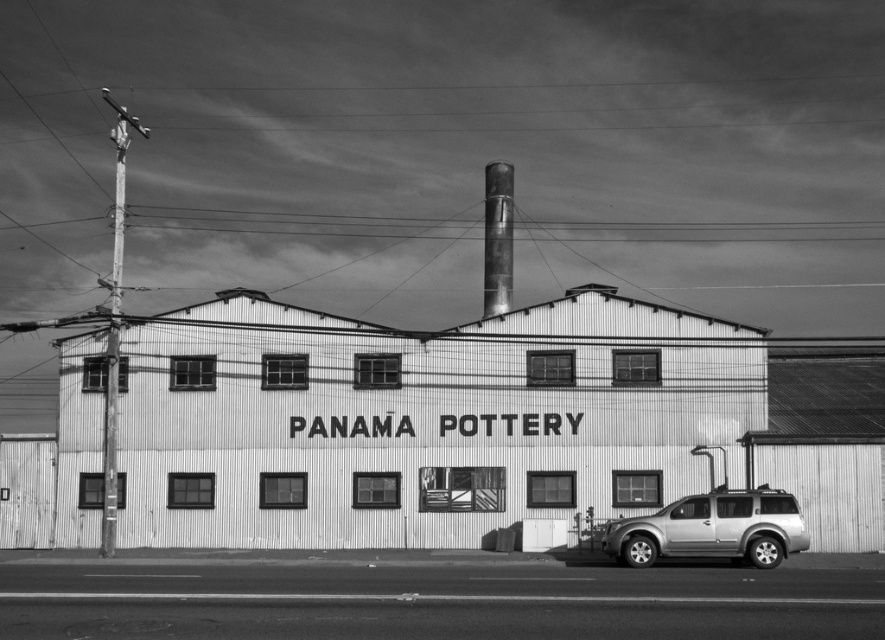
Question: Does metallic corrugated building at center have a greater width compared to silver metallic suv at lower right?

Choices:
 (A) no
 (B) yes

Answer: (B)

Question: Is metallic corrugated building at center to the right of silver metallic suv at lower right from the viewer's perspective?

Choices:
 (A) yes
 (B) no

Answer: (B)

Question: Which of the following is the closest to the observer?

Choices:
 (A) 44,531
 (B) 686,499

Answer: (B)

Question: Does metallic corrugated building at center come behind silver metallic suv at lower right?

Choices:
 (A) yes
 (B) no

Answer: (A)